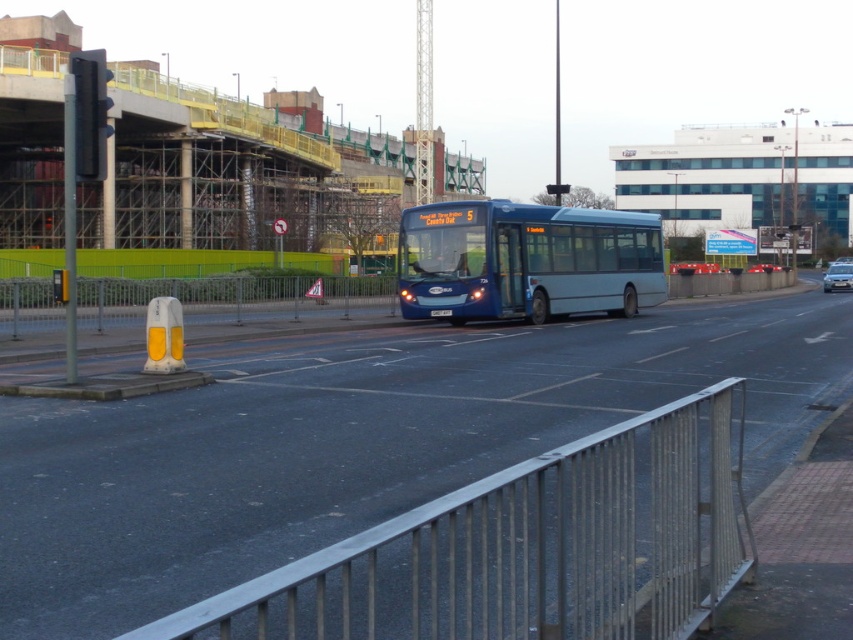
Does matte blue bus at center lie behind silver metallic sedan at right?

No.

The height and width of the screenshot is (640, 853). What do you see at coordinates (526, 260) in the screenshot?
I see `matte blue bus at center` at bounding box center [526, 260].

You are a GUI agent. You are given a task and a screenshot of the screen. Output one action in this format:
    pyautogui.click(x=<x>, y=<y>)
    Task: Click on the matte blue bus at center
    The image size is (853, 640).
    Given the screenshot: What is the action you would take?
    pyautogui.click(x=526, y=260)

Where is `matte blue bus at center`? This screenshot has width=853, height=640. matte blue bus at center is located at coordinates (526, 260).

Who is shorter, silver metallic rail at lower center or silver metallic sedan at right?

Standing shorter between the two is silver metallic rail at lower center.

Can you confirm if silver metallic rail at lower center is shorter than silver metallic sedan at right?

Indeed, silver metallic rail at lower center has a lesser height compared to silver metallic sedan at right.

Who is more forward, (474, 572) or (840, 273)?

Point (474, 572)

You are a GUI agent. You are given a task and a screenshot of the screen. Output one action in this format:
    pyautogui.click(x=<x>, y=<y>)
    Task: Click on the silver metallic rail at lower center
    
    Given the screenshot: What is the action you would take?
    pyautogui.click(x=529, y=547)

Consider the image. Who is more forward, (491, 588) or (421, 284)?

Point (491, 588) is in front.

Does silver metallic rail at lower center have a larger size compared to matte blue bus at center?

No.

This screenshot has width=853, height=640. Describe the element at coordinates (529, 547) in the screenshot. I see `silver metallic rail at lower center` at that location.

The image size is (853, 640). Identify the location of silver metallic rail at lower center. (529, 547).